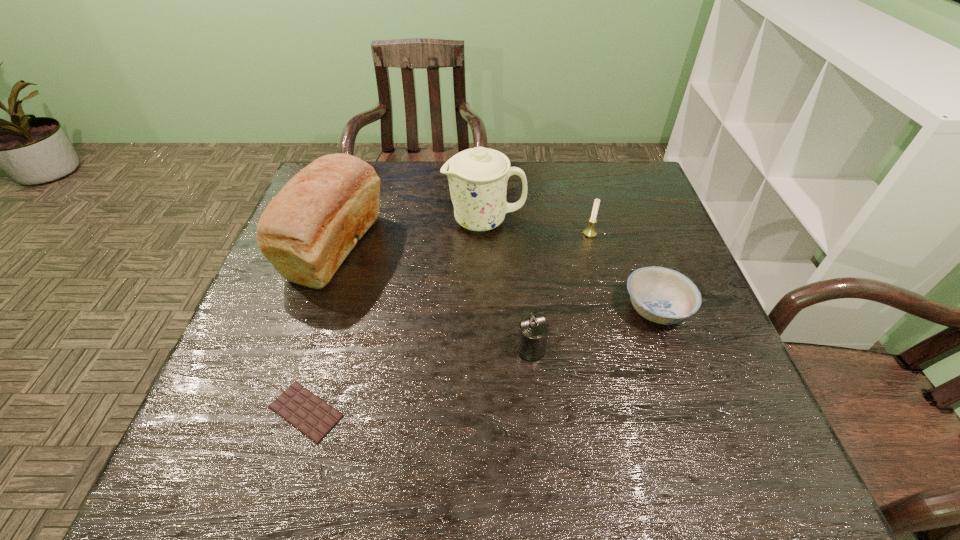
Locate an element on the screen. Image resolution: width=960 pixels, height=540 pixels. vacant space at the near right corner of the desktop is located at coordinates (735, 450).

Locate an element on the screen. This screenshot has width=960, height=540. free space between the fifth farthest object and the chinaware is located at coordinates (508, 285).

Where is `empty space that is in between the fifth tallest object and the candle holder`? The height and width of the screenshot is (540, 960). empty space that is in between the fifth tallest object and the candle holder is located at coordinates (623, 271).

This screenshot has height=540, width=960. I want to click on vacant space that is in between the fifth farthest object and the chinaware, so click(508, 285).

This screenshot has height=540, width=960. What are the coordinates of `empty location between the chinaware and the second nearest object` in the screenshot? It's located at (508, 285).

This screenshot has height=540, width=960. Find the location of `unoccupied area between the nearest object and the second object from right to left`. unoccupied area between the nearest object and the second object from right to left is located at coordinates (448, 322).

Locate an element on the screen. Image resolution: width=960 pixels, height=540 pixels. vacant space in between the bread and the bowl is located at coordinates (496, 278).

Find the location of a particular element. This screenshot has width=960, height=540. vacant space that is in between the nearest object and the second nearest object is located at coordinates (419, 380).

This screenshot has height=540, width=960. I want to click on vacant space that's between the chocolate bar and the second object from right to left, so click(448, 322).

Where is `vacant space that is in between the bowl and the fifth object from left to right`? Image resolution: width=960 pixels, height=540 pixels. vacant space that is in between the bowl and the fifth object from left to right is located at coordinates (623, 271).